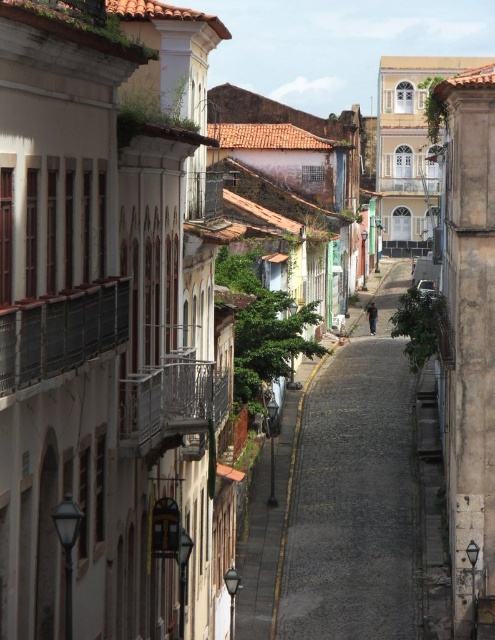
Can you confirm if cobblestone street at center is smaller than brown stone wall at right?

Actually, cobblestone street at center might be larger than brown stone wall at right.

Can you confirm if cobblestone street at center is bigger than brown stone wall at right?

Yes.

Where is `cobblestone street at center`? This screenshot has width=495, height=640. cobblestone street at center is located at coordinates (353, 493).

Image resolution: width=495 pixels, height=640 pixels. Identify the location of cobblestone street at center. (x=353, y=493).